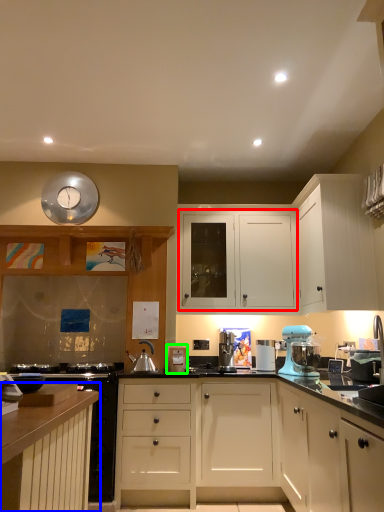
Question: Considering the real-world distances, which object is closest to cabinetry (highlighted by a red box)? cabinetry (highlighted by a blue box) or appliance (highlighted by a green box).

Choices:
 (A) cabinetry
 (B) appliance

Answer: (B)